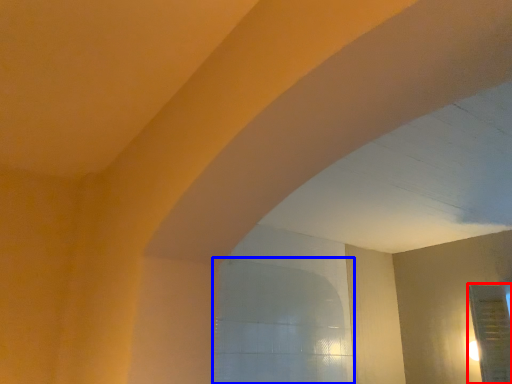
Question: Which of the following is the closest to the observer, glass door (highlighted by a red box) or window (highlighted by a blue box)?

Choices:
 (A) glass door
 (B) window

Answer: (B)